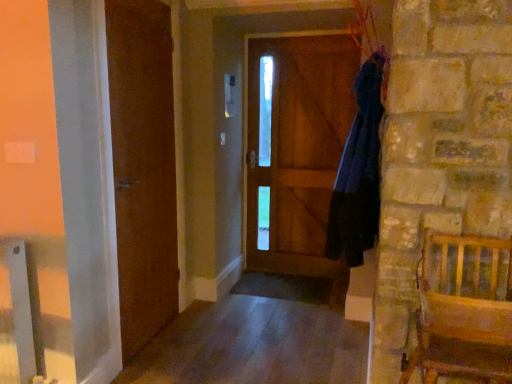
Image resolution: width=512 pixels, height=384 pixels. I want to click on smooth wood floor at lower center, so click(259, 338).

What do you see at coordinates (259, 338) in the screenshot? Image resolution: width=512 pixels, height=384 pixels. I see `smooth wood floor at lower center` at bounding box center [259, 338].

In order to face brown wooden door at left, should I rotate leftwards or rightwards?

Turn left by 14.129 degrees to look at brown wooden door at left.

The height and width of the screenshot is (384, 512). I want to click on smooth wood floor at lower center, so click(x=259, y=338).

From a real-world perspective, relative to wooden screen door at center, is brown wooden door at left vertically above or below?

brown wooden door at left is situated higher than wooden screen door at center in the real world.

Is brown wooden door at left facing away from wooden screen door at center?

That's not correct — brown wooden door at left is not looking away from wooden screen door at center.

Does brown wooden door at left have a lesser width compared to wooden screen door at center?

No, brown wooden door at left is not thinner than wooden screen door at center.

In terms of width, does wooden screen door at center look wider or thinner when compared to wooden chair at right?

Considering their sizes, wooden screen door at center looks slimmer than wooden chair at right.

From the image's perspective, is wooden screen door at center above or below wooden chair at right?

Based on their image positions, wooden screen door at center is located above wooden chair at right.

Does wooden screen door at center have a lesser height compared to wooden chair at right?

In fact, wooden screen door at center may be taller than wooden chair at right.

In the image, is dark blue fabric at right positioned in front of or behind brown wooden door at left?

dark blue fabric at right is positioned farther from the viewer than brown wooden door at left.

Which object is wider, dark blue fabric at right or brown wooden door at left?

Wider between the two is dark blue fabric at right.

Is dark blue fabric at right positioned with its back to brown wooden door at left?

No, dark blue fabric at right is not facing away from brown wooden door at left.

Based on the photo, is dark blue fabric at right located outside brown wooden door at left?

Absolutely, dark blue fabric at right is external to brown wooden door at left.

Who is smaller, wooden chair at right or dark blue fabric at right?

dark blue fabric at right is smaller.

Considering the points (490, 281) and (359, 211), which point is in front, point (490, 281) or point (359, 211)?

Positioned in front is point (490, 281).

Is wooden chair at right inside the boundaries of dark blue fabric at right, or outside?

wooden chair at right cannot be found inside dark blue fabric at right.

Where is `dress lying behind the wooden chair at right`? The height and width of the screenshot is (384, 512). dress lying behind the wooden chair at right is located at coordinates (358, 173).

Locate an element on the screen. The image size is (512, 384). barn door located on the left of smooth wood floor at lower center is located at coordinates (143, 166).

Between smooth wood floor at lower center and brown wooden door at left, which one appears on the left side from the viewer's perspective?

From the viewer's perspective, brown wooden door at left appears more on the left side.

Consider the image. Is smooth wood floor at lower center taller than brown wooden door at left?

Incorrect, the height of smooth wood floor at lower center is not larger of that of brown wooden door at left.

From the image's perspective, is smooth wood floor at lower center under brown wooden door at left?

Yes, from the image's perspective, smooth wood floor at lower center is below brown wooden door at left.

Between wooden chair at right and smooth wood floor at lower center, which one has smaller width?

wooden chair at right is thinner.

From a real-world perspective, is wooden chair at right physically located above or below smooth wood floor at lower center?

From a real-world perspective, wooden chair at right is physically above smooth wood floor at lower center.

Is wooden chair at right at the left side of smooth wood floor at lower center?

Incorrect, wooden chair at right is not on the left side of smooth wood floor at lower center.

From the picture: Would you say wooden chair at right is a long distance from smooth wood floor at lower center?

Yes, wooden chair at right is far from smooth wood floor at lower center.

Does wooden screen door at center lie behind dark blue fabric at right?

Yes, wooden screen door at center is behind dark blue fabric at right.

Which is correct: wooden screen door at center is inside dark blue fabric at right, or outside of it?

wooden screen door at center is spatially situated outside dark blue fabric at right.

Is wooden screen door at center at the right side of dark blue fabric at right?

No.

What are the coordinates of `screen door below the brown wooden door at left (from a real-world perspective)` in the screenshot? It's located at (295, 147).

You are a GUI agent. You are given a task and a screenshot of the screen. Output one action in this format:
    pyautogui.click(x=<x>, y=<y>)
    Task: Click on the screen door that is behind the wooden chair at right
    This screenshot has height=384, width=512.
    Given the screenshot: What is the action you would take?
    pyautogui.click(x=295, y=147)

When comparing their distances from wooden chair at right, does dark blue fabric at right or brown wooden door at left seem further?

brown wooden door at left is further to wooden chair at right.

In the scene shown: Estimate the real-world distances between objects in this image. Which object is closer to smooth wood floor at lower center, wooden screen door at center or brown wooden door at left?

brown wooden door at left is closer to smooth wood floor at lower center.

Consider the image. When comparing their distances from wooden screen door at center, does smooth wood floor at lower center or dark blue fabric at right seem further?

Among the two, dark blue fabric at right is located further to wooden screen door at center.

Consider the image. Estimate the real-world distances between objects in this image. Which object is further from smooth wood floor at lower center, brown wooden door at left or wooden chair at right?

wooden chair at right.

Which object lies nearer to the anchor point smooth wood floor at lower center, wooden chair at right or dark blue fabric at right?

dark blue fabric at right is positioned closer to the anchor smooth wood floor at lower center.

From the image, which object appears to be nearer to dark blue fabric at right, smooth wood floor at lower center or brown wooden door at left?

smooth wood floor at lower center lies closer to dark blue fabric at right than the other object.

Estimate the real-world distances between objects in this image. Which object is further from brown wooden door at left, wooden chair at right or dark blue fabric at right?

The object further to brown wooden door at left is wooden chair at right.

Consider the image. Considering their positions, is dark blue fabric at right positioned closer to wooden screen door at center than wooden chair at right?

Among the two, dark blue fabric at right is located nearer to wooden screen door at center.

I want to click on barn door positioned between smooth wood floor at lower center and wooden screen door at center from near to far, so click(143, 166).

Locate an element on the screen. The width and height of the screenshot is (512, 384). barn door located between wooden chair at right and wooden screen door at center in the depth direction is located at coordinates (143, 166).

Find the location of `alley located between brown wooden door at left and wooden chair at right in the left-right direction`. alley located between brown wooden door at left and wooden chair at right in the left-right direction is located at coordinates (259, 338).

The width and height of the screenshot is (512, 384). I want to click on dress positioned between smooth wood floor at lower center and wooden screen door at center from near to far, so click(358, 173).